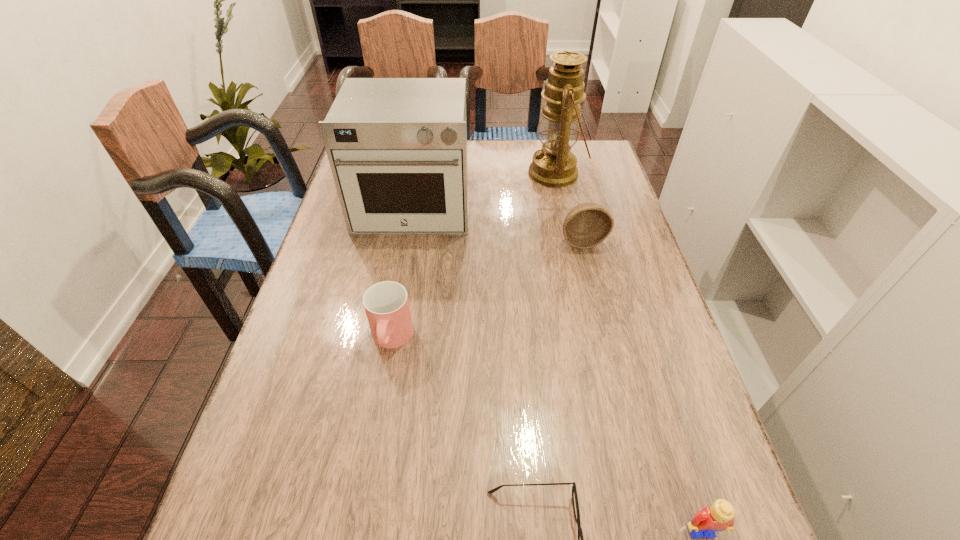
You are a GUI agent. You are given a task and a screenshot of the screen. Output one action in this format:
    pyautogui.click(x=<x>, y=<y>)
    Task: Click on the empty space that is in between the bowl and the cup
    The height and width of the screenshot is (540, 960).
    Given the screenshot: What is the action you would take?
    pyautogui.click(x=487, y=290)

At what (x,y) coordinates should I click in order to perform the action: click on vacant area that lies between the cup and the toaster oven. Please return your answer as a coordinate pair (x, y). Looking at the image, I should click on (402, 273).

Select which object appears as the fifth closest to the toaster oven. Please provide its 2D coordinates. Your answer should be formatted as a tuple, i.e. [(x, y)], where the tuple contains the x and y coordinates of a point satisfying the conditions above.

[(718, 517)]

Select which object appears as the closest to the oil lamp. Please provide its 2D coordinates. Your answer should be formatted as a tuple, i.e. [(x, y)], where the tuple contains the x and y coordinates of a point satisfying the conditions above.

[(586, 225)]